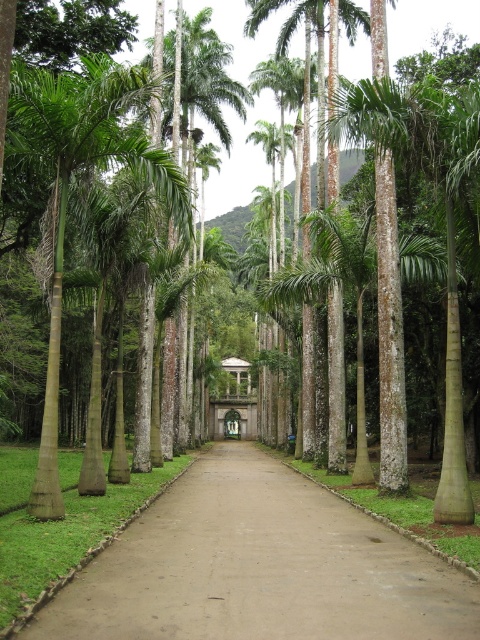
You are a gardener walking along the brown dirt path at center and notice the green smooth palm tree at left. Which object occupies more space in the scene?

The brown dirt path at center occupies more space in the scene compared to the green smooth palm tree at left, as it has a larger size.

You are standing on the pathway and want to know which palm tree is closer to you. The green smooth palm tree at left and the green textured palm tree at center are both visible. Which one is nearer?

The green smooth palm tree at left is shorter than the green textured palm tree at center, so it is likely closer to you since shorter objects appear closer in such a setting.